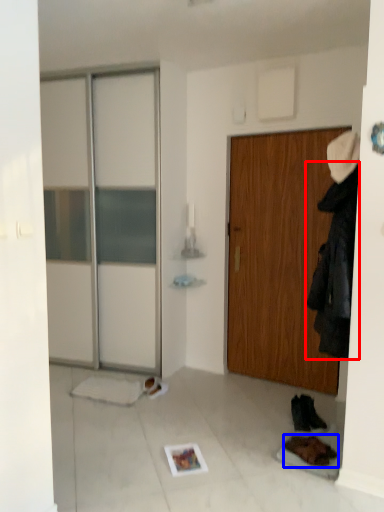
Question: Which point is further to the camera, clothing (highlighted by a red box) or footwear (highlighted by a blue box)?

Choices:
 (A) clothing
 (B) footwear

Answer: (B)